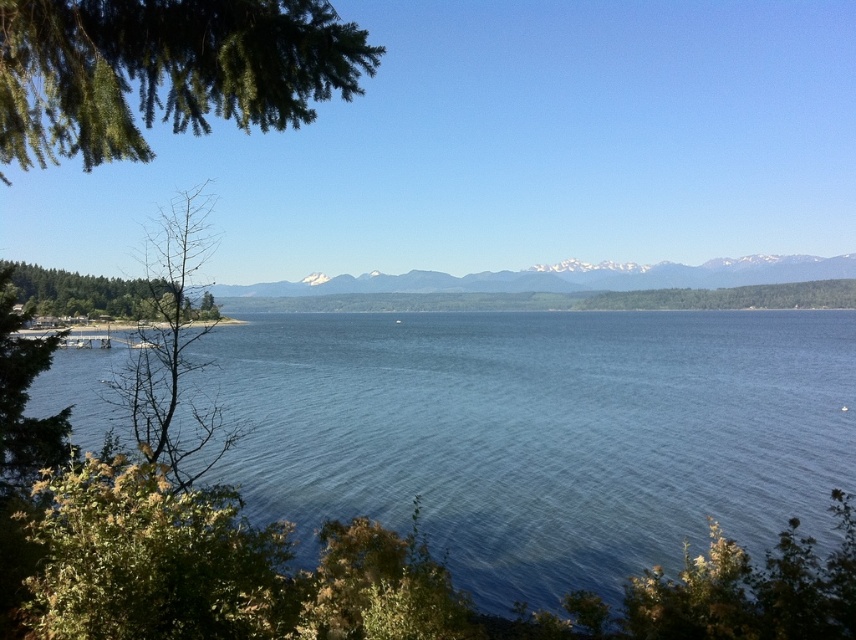
You are standing on the shore looking out at the blue water at center and the green matte tree at left. Which object is closer to your right side?

The blue water at center is closer to your right side because it is positioned on the right side of the green matte tree at left.

You are a photographer planning to capture the blue water at center and the green leafy tree at lower left in a single frame. Based on their sizes in the image, which object would appear more dominant in the composition?

The blue water at center would appear more dominant in the composition since it has a larger size compared to the green leafy tree at lower left.

You are standing at the shoreline and want to reach both the point at coordinates point (712,384) and point (33,340). Which point is closer to you?

Point (33,340) is closer to you because it is nearer than point (712,384), which is further away from the camera.